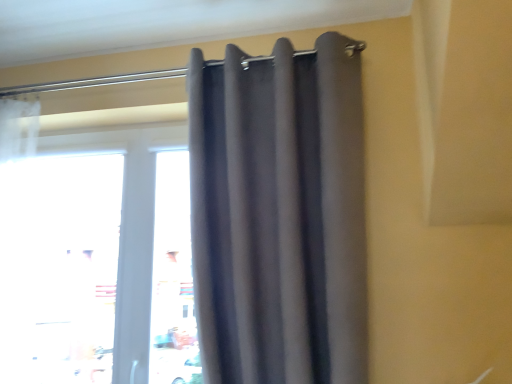
Question: From their relative heights in the image, would you say transparent glass window at center is taller or shorter than dark gray fabric curtain at upper center?

Choices:
 (A) tall
 (B) short

Answer: (B)

Question: Considering the relative positions of transparent glass window at center and dark gray fabric curtain at upper center in the image provided, is transparent glass window at center to the left or to the right of dark gray fabric curtain at upper center?

Choices:
 (A) left
 (B) right

Answer: (A)

Question: From the image's perspective, relative to dark gray fabric curtain at upper center, is transparent glass window at center above or below?

Choices:
 (A) above
 (B) below

Answer: (B)

Question: Is dark gray fabric curtain at upper center taller or shorter than transparent glass window at center?

Choices:
 (A) short
 (B) tall

Answer: (B)

Question: In terms of width, does dark gray fabric curtain at upper center look wider or thinner when compared to transparent glass window at center?

Choices:
 (A) thin
 (B) wide

Answer: (B)

Question: Considering the positions of point (204, 347) and point (29, 233), is point (204, 347) closer or farther from the camera than point (29, 233)?

Choices:
 (A) farther
 (B) closer

Answer: (B)

Question: From the image's perspective, is dark gray fabric curtain at upper center above or below transparent glass window at center?

Choices:
 (A) above
 (B) below

Answer: (A)